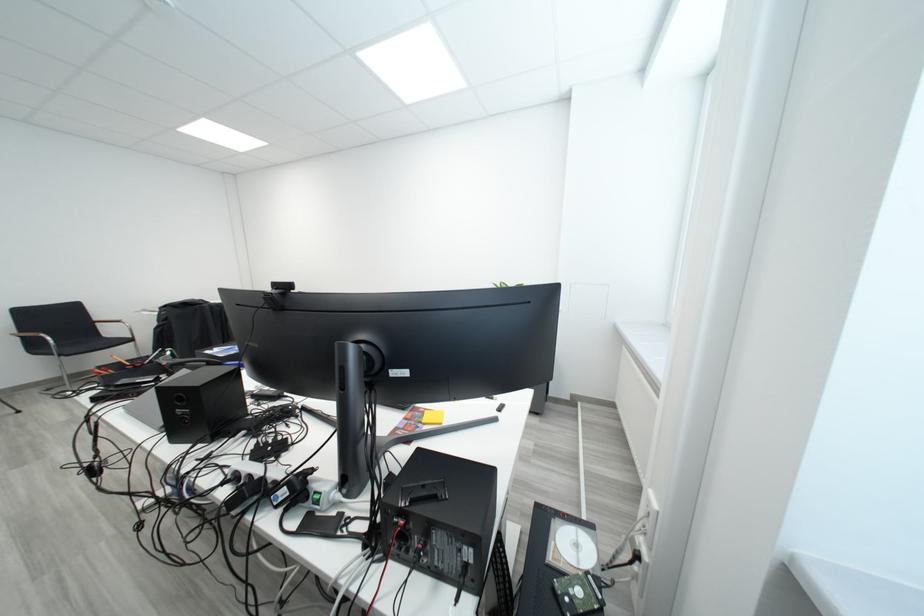
Image resolution: width=924 pixels, height=616 pixels. I want to click on chair sitting surface, so click(x=82, y=342).